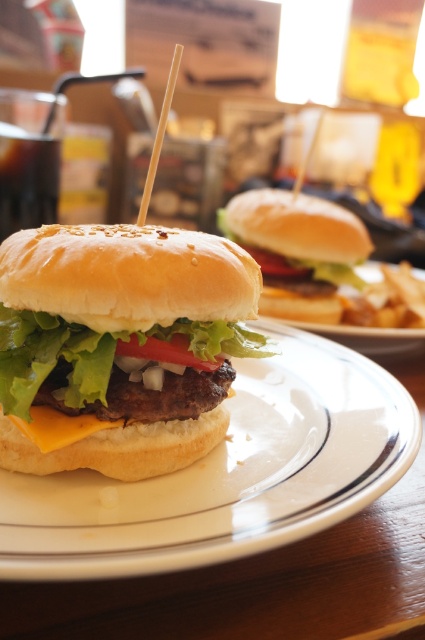
Is slightly toasted bun at center bigger than yellowish cheese at center?

Correct, slightly toasted bun at center is larger in size than yellowish cheese at center.

Between point (342, 276) and point (73, 433), which one is positioned in front?

Point (73, 433)

Which is behind, point (319, 227) or point (27, 426)?

The point (319, 227) is behind.

In order to click on slightly toasted bun at center in this screenshot , I will do `click(297, 250)`.

Can you confirm if semi-glossy bun at center is shorter than yellowish cheese at center?

No, semi-glossy bun at center is not shorter than yellowish cheese at center.

What are the coordinates of `semi-glossy bun at center` in the screenshot? It's located at (121, 342).

Is point (136, 394) farther from viewer compared to point (105, 426)?

Yes, it is behind point (105, 426).

Identify the location of semi-glossy bun at center. (121, 342).

Does semi-glossy bun at center have a greater width compared to slightly toasted bun at center?

Incorrect, semi-glossy bun at center's width does not surpass slightly toasted bun at center's.

Does point (153, 404) come closer to viewer compared to point (274, 237)?

That is True.

Is point (51, 385) farther from viewer compared to point (289, 228)?

No, it is in front of (289, 228).

Find the location of a particular element. This screenshot has width=425, height=640. semi-glossy bun at center is located at coordinates (121, 342).